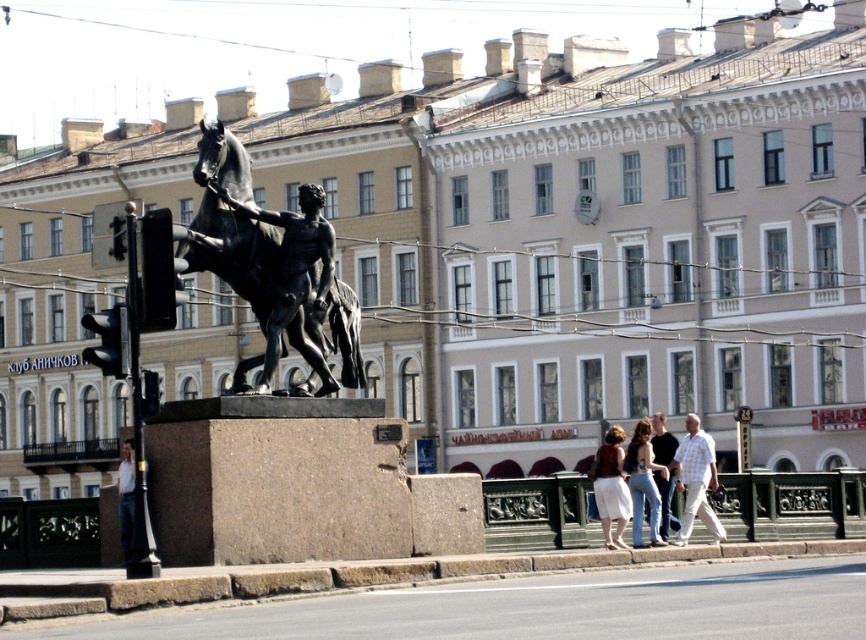
Question: Is white cotton skirt at lower center positioned in front of denim jeans at lower right?

Choices:
 (A) no
 (B) yes

Answer: (B)

Question: Which object is the closest to the bronze statue at center?

Choices:
 (A) white cotton skirt at lower center
 (B) white checkered shirt at center
 (C) denim jeans at lower right
 (D) light blue jeans at center

Answer: (C)

Question: Is white checkered shirt at center wider than white cotton skirt at lower center?

Choices:
 (A) yes
 (B) no

Answer: (A)

Question: Observing the image, what is the correct spatial positioning of denim jeans at lower right in reference to light blue jeans at center?

Choices:
 (A) above
 (B) below

Answer: (B)

Question: Which point appears farthest from the camera in this image?

Choices:
 (A) (638, 506)
 (B) (671, 496)

Answer: (B)

Question: Which object is positioned farthest from the light blue jeans at center?

Choices:
 (A) bronze statue at center
 (B) white cotton skirt at lower center
 (C) white checkered shirt at center
 (D) denim jeans at lower right

Answer: (A)